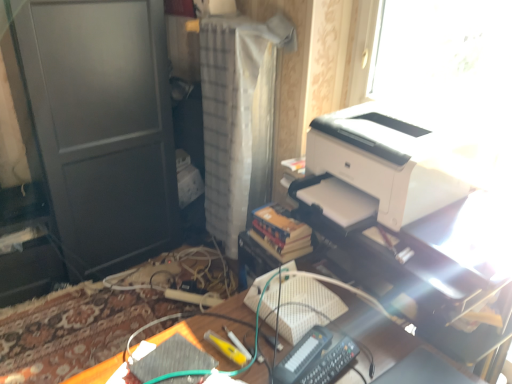
The height and width of the screenshot is (384, 512). I want to click on vacant region above wooden desk at center (from a real-world perspective), so click(272, 353).